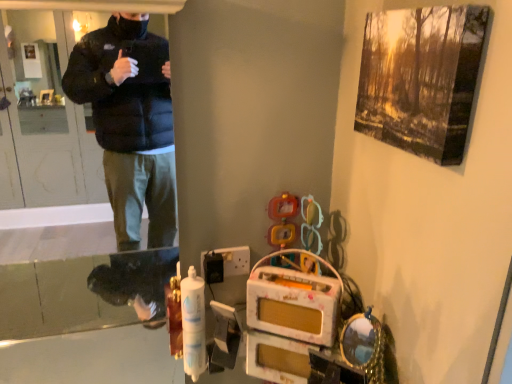
Question: From the image's perspective, is black plastic switch at lower center positioned above or below transparent plastic screen door at left?

Choices:
 (A) below
 (B) above

Answer: (A)

Question: Considering the positions of black plastic switch at lower center and transparent plastic screen door at left in the image, is black plastic switch at lower center wider or thinner than transparent plastic screen door at left?

Choices:
 (A) wide
 (B) thin

Answer: (B)

Question: From a real-world perspective, is black plastic switch at lower center positioned above or below transparent plastic screen door at left?

Choices:
 (A) above
 (B) below

Answer: (B)

Question: Is transparent plastic screen door at left wider or thinner than black plastic switch at lower center?

Choices:
 (A) wide
 (B) thin

Answer: (A)

Question: From a real-world perspective, relative to black plastic switch at lower center, is transparent plastic screen door at left vertically above or below?

Choices:
 (A) below
 (B) above

Answer: (B)

Question: Is point [84, 263] closer or farther from the camera than point [236, 254]?

Choices:
 (A) closer
 (B) farther

Answer: (B)

Question: Is transparent plastic screen door at left inside the boundaries of black plastic switch at lower center, or outside?

Choices:
 (A) inside
 (B) outside

Answer: (B)